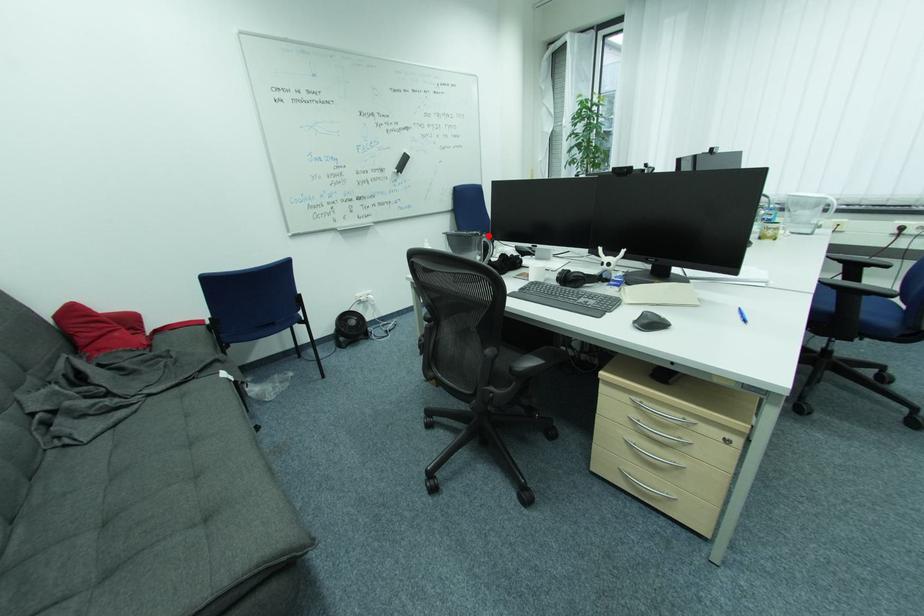
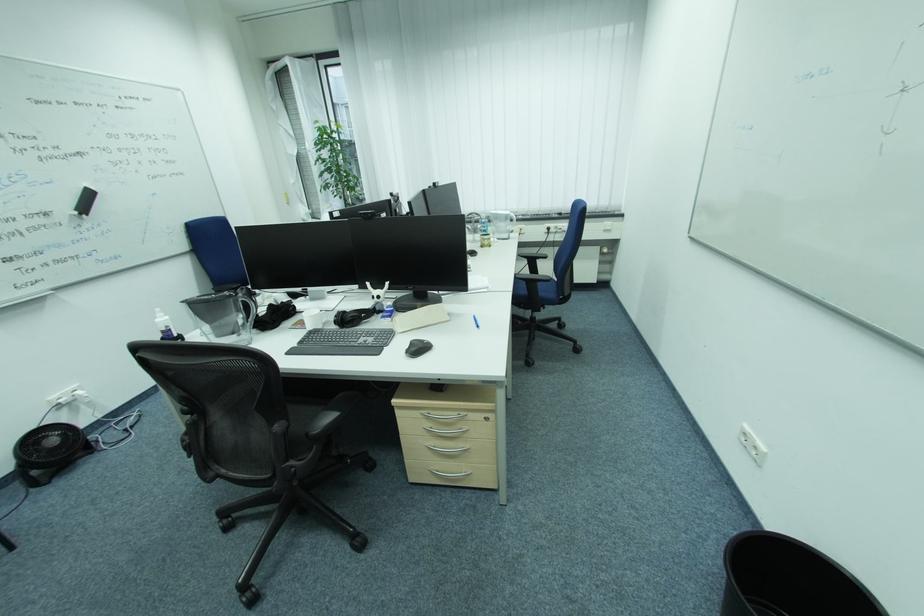
Question: I am providing you with two images of the same scene from different viewpoints. A red point is shown in image1. For the corresponding object point in image2, is it positioned nearer or farther from the camera?

Choices:
 (A) Nearer
 (B) Farther

Answer: (A)